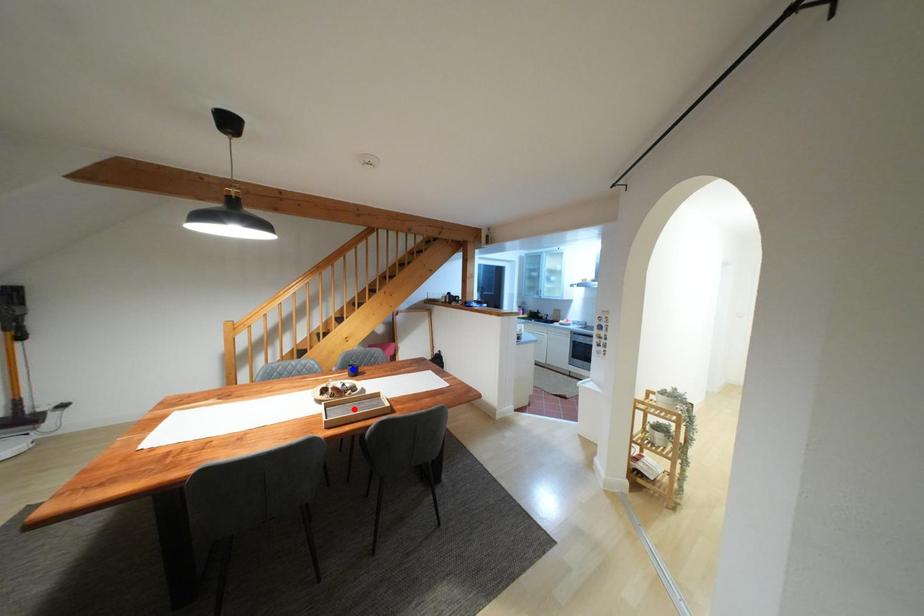
Question: Which of the two points in the image is closer to the camera?

Choices:
 (A) Blue point is closer.
 (B) Red point is closer.

Answer: (B)